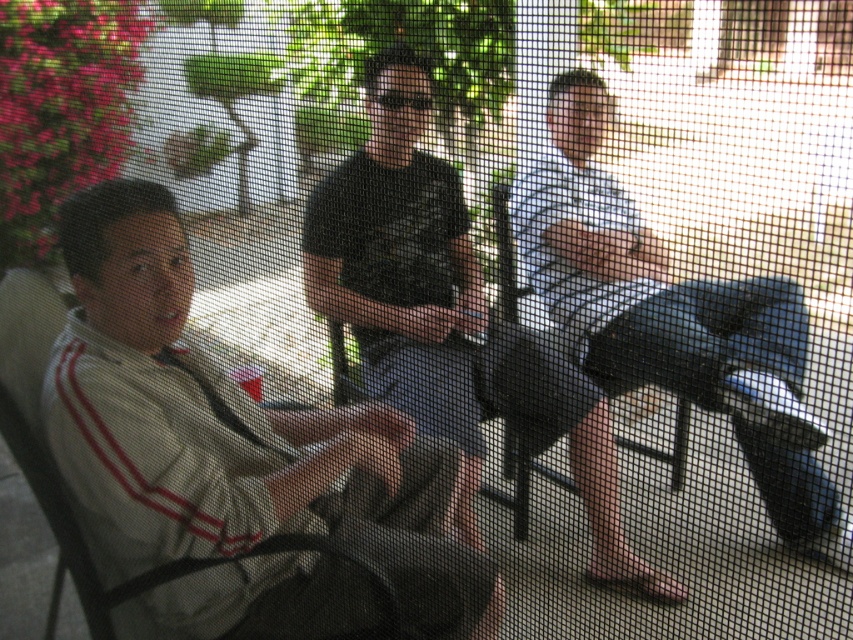
Is point (677, 593) less distant than point (503, 435)?

Yes, point (677, 593) is in front of point (503, 435).

Which is behind, point (399, 368) or point (672, 467)?

Point (672, 467)

Locate an element on the screen. The width and height of the screenshot is (853, 640). black matte shirt at center is located at coordinates (403, 266).

Between white fabric jacket at left and black plastic chair at center, which one appears on the right side from the viewer's perspective?

black plastic chair at center is more to the right.

What do you see at coordinates (230, 433) in the screenshot? I see `white fabric jacket at left` at bounding box center [230, 433].

This screenshot has width=853, height=640. Find the location of `white fabric jacket at left`. white fabric jacket at left is located at coordinates (230, 433).

Which is more to the right, white fabric jacket at left or black matte shirt at center?

Positioned to the right is black matte shirt at center.

From the picture: Can you confirm if white fabric jacket at left is thinner than black matte shirt at center?

No.

Locate an element on the screen. white fabric jacket at left is located at coordinates (230, 433).